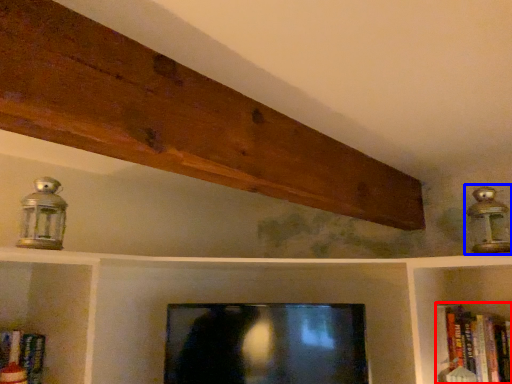
Question: Which object appears farthest to the camera in this image, book (highlighted by a red box) or lamp (highlighted by a blue box)?

Choices:
 (A) book
 (B) lamp

Answer: (A)